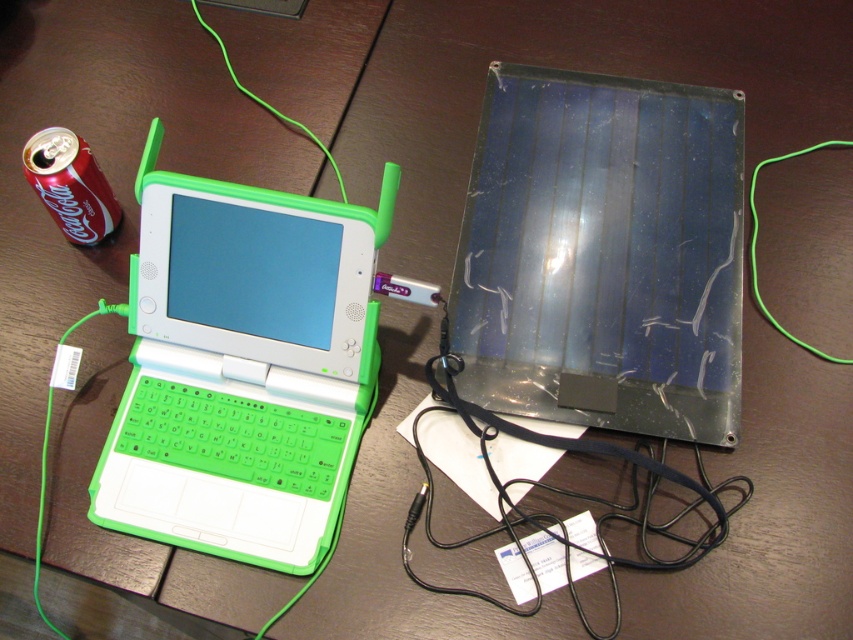
You are a technician trying to access the green matte laptop at left. Since the transparent plastic solar panel at center is blocking your view, can you move the solar panel to the side to reach the laptop?

The green matte laptop at left is behind the transparent plastic solar panel at center, so you can move the transparent plastic solar panel at center to the side to access the green matte laptop at left.

You are standing in front of the laptop and want to place a small object on the point that is closer to you. Which point should you choose between point (x=521, y=323) and point (x=107, y=221)?

Point (x=107, y=221) is closer to you because it is behind point (x=521, y=323), so placing the object there would be closer to your current position.

You are a delivery person standing in front of a wooden desk. You need to place a package that is 30 inches long on the desk. The desk has the green matte laptop at left on it. Can you fit the package on the desk without moving the laptop?

The green matte laptop at left is 28.09 inches away from the viewer. Since the package is 30 inches long, it may not fit on the desk without overlapping the laptop or exceeding the desk space.